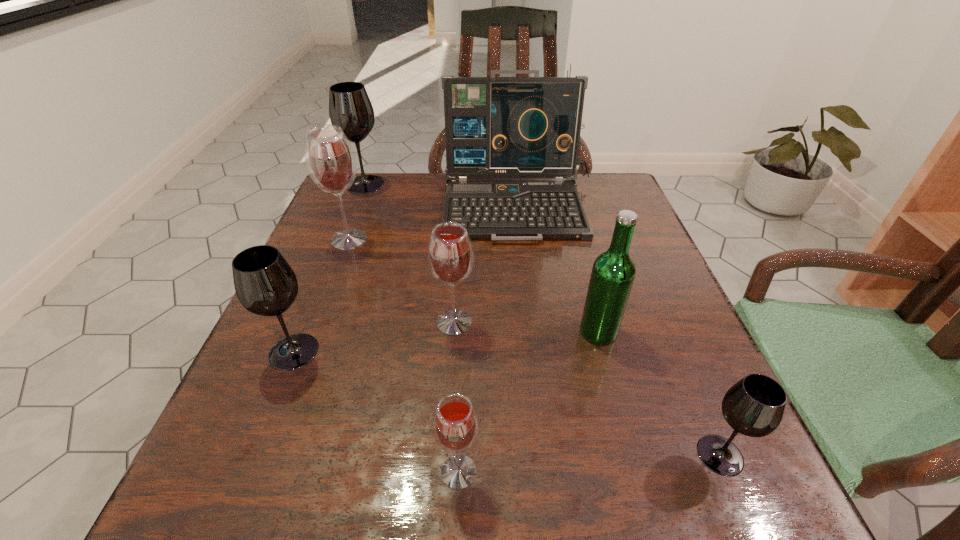
Locate an element on the screen. This screenshot has width=960, height=540. vacant area at the right edge is located at coordinates (691, 412).

Image resolution: width=960 pixels, height=540 pixels. What are the coordinates of `vacant space at the far left corner` in the screenshot? It's located at (374, 206).

At what (x,y) coordinates should I click in order to perform the action: click on blank space at the far right corner of the desktop. Please return your answer as a coordinate pair (x, y). Looking at the image, I should click on (591, 200).

Where is `vacant point located between the beer bottle and the second smallest gray wineglass`? vacant point located between the beer bottle and the second smallest gray wineglass is located at coordinates (446, 342).

Find the location of a particular element. The image size is (960, 540). vacant space that is in between the leftmost red wineglass and the nearest red wineglass is located at coordinates (404, 356).

In order to click on free area in between the biggest gray wineglass and the smallest gray wineglass in this screenshot , I will do `click(542, 320)`.

The width and height of the screenshot is (960, 540). Identify the location of vacant area that lies between the smallest red wineglass and the beer bottle. (529, 402).

Where is `vacant point located between the beer bottle and the rightmost wineglass`? Image resolution: width=960 pixels, height=540 pixels. vacant point located between the beer bottle and the rightmost wineglass is located at coordinates (660, 394).

You are a GUI agent. You are given a task and a screenshot of the screen. Output one action in this format:
    pyautogui.click(x=<x>, y=<y>)
    Task: Click on the free space that is in between the laptop computer and the rightmost object
    
    Given the screenshot: What is the action you would take?
    pyautogui.click(x=619, y=330)

Image resolution: width=960 pixels, height=540 pixels. Find the location of `free spot between the second biggest gray wineglass and the second nearest red wineglass`. free spot between the second biggest gray wineglass and the second nearest red wineglass is located at coordinates (374, 337).